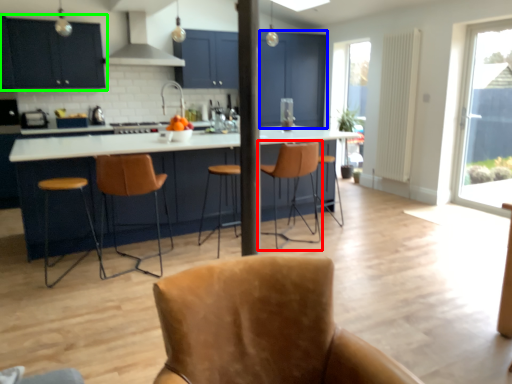
Question: Based on their relative distances, which object is nearer to chair (highlighted by a red box)? Choose from screen door (highlighted by a blue box) and cabinetry (highlighted by a green box).

Choices:
 (A) screen door
 (B) cabinetry

Answer: (B)